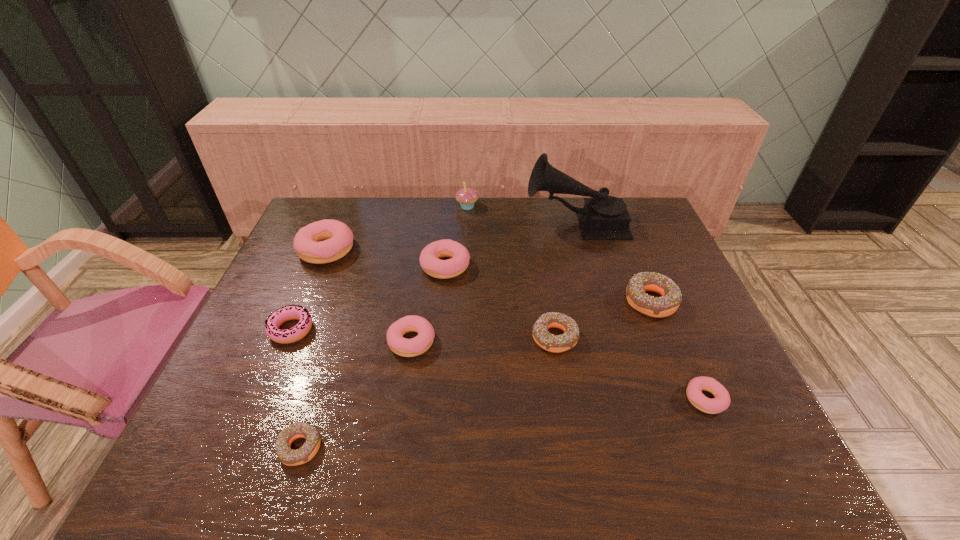
The height and width of the screenshot is (540, 960). What are the coordinates of `pink doughnut that stands as the closest to the second biggest pink doughnut` in the screenshot? It's located at (401, 346).

You are a GUI agent. You are given a task and a screenshot of the screen. Output one action in this format:
    pyautogui.click(x=<x>, y=<y>)
    Task: Click on the pink doughnut that is the third closest to the leftmost chocolate doughnut
    
    Given the screenshot: What is the action you would take?
    click(429, 258)

Locate an element on the screen. The height and width of the screenshot is (540, 960). chocolate doughnut that stands as the second closest to the ninth shortest object is located at coordinates (658, 307).

This screenshot has width=960, height=540. I want to click on chocolate doughnut that is the closest to the fourth smallest pink doughnut, so click(x=553, y=343).